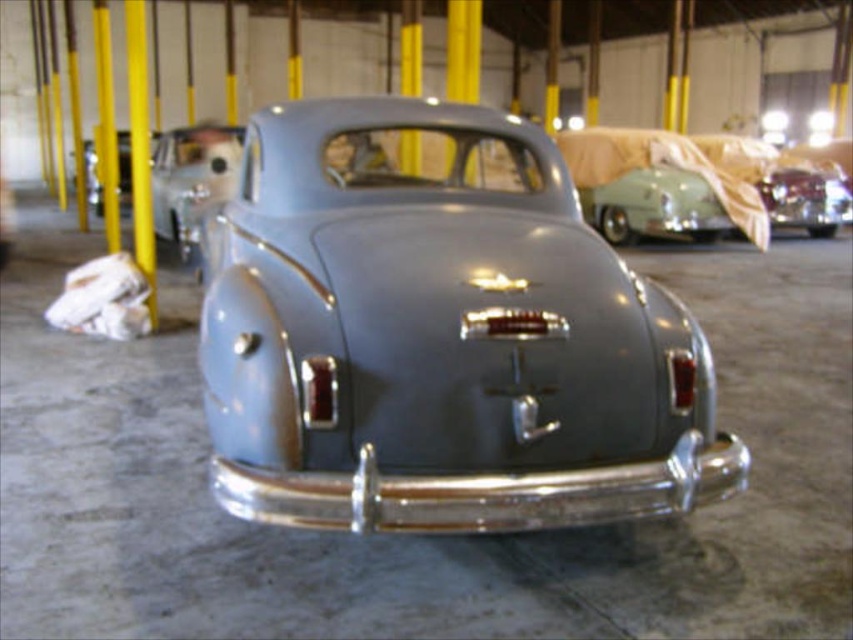
Who is positioned more to the right, satin gray car at center or matte gray car at center?

From the viewer's perspective, satin gray car at center appears more on the right side.

Can you confirm if satin gray car at center is smaller than matte gray car at center?

Incorrect, satin gray car at center is not smaller in size than matte gray car at center.

Is point (538, 209) less distant than point (181, 237)?

Yes, it is.

The image size is (853, 640). I want to click on satin gray car at center, so point(440,336).